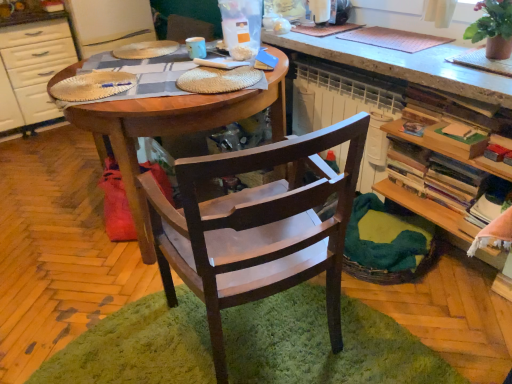
Question: From the image's perspective, is white glossy cabinet at left positioned above or below dark wood chair at center?

Choices:
 (A) below
 (B) above

Answer: (B)

Question: Does point (17, 62) appear closer or farther from the camera than point (194, 180)?

Choices:
 (A) closer
 (B) farther

Answer: (B)

Question: Which object is positioned closest to the dark wood chair at center?

Choices:
 (A) white glossy cabinet at left
 (B) wooden bookshelf at right
 (C) green shaggy rug at center
 (D) woven brown basket at lower right
 (E) wooden table at center

Answer: (C)

Question: Considering the real-world distances, which object is closest to the woven brown basket at lower right?

Choices:
 (A) dark wood chair at center
 (B) green shaggy rug at center
 (C) wooden bookshelf at right
 (D) white glossy cabinet at left
 (E) wooden table at center

Answer: (C)